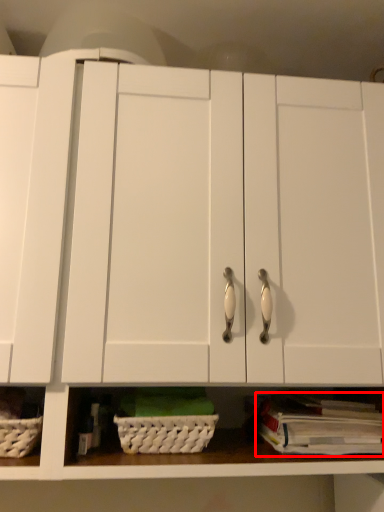
Question: From the image's perspective, where is book (annotated by the red box) located in relation to basket in the image?

Choices:
 (A) below
 (B) above

Answer: (A)